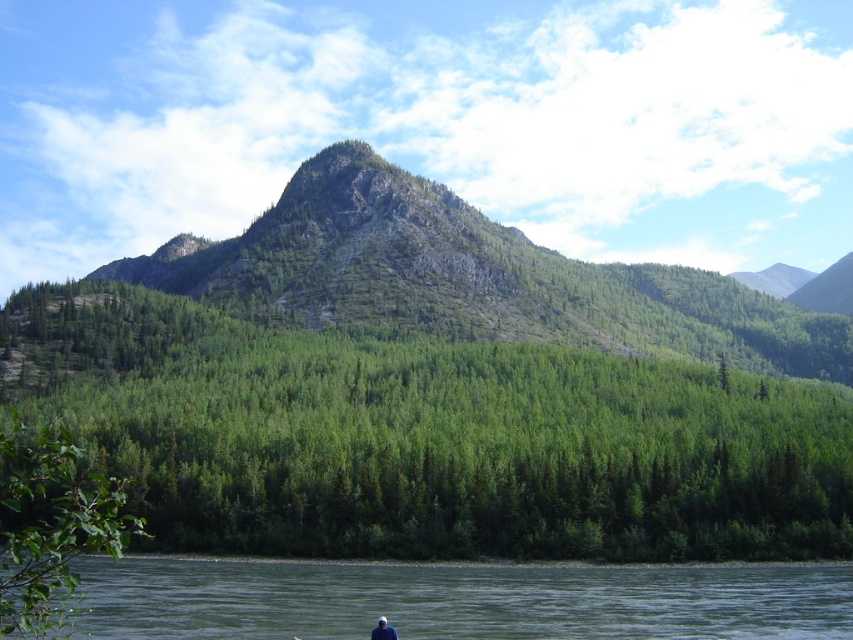
Question: Which point is farther to the camera?

Choices:
 (A) (546, 433)
 (B) (387, 632)

Answer: (A)

Question: Which is nearer to the green leafy branch at lower left?

Choices:
 (A) green leafy forest at center
 (B) green smooth water at lower center
 (C) blue fabric person at lower center

Answer: (B)

Question: Which object appears closest to the camera in this image?

Choices:
 (A) green leafy forest at center
 (B) green smooth water at lower center
 (C) blue fabric person at lower center

Answer: (B)

Question: Does green smooth water at lower center appear under green leafy branch at lower left?

Choices:
 (A) yes
 (B) no

Answer: (A)

Question: Observing the image, what is the correct spatial positioning of green smooth water at lower center in reference to blue fabric person at lower center?

Choices:
 (A) right
 (B) left

Answer: (B)

Question: Observing the image, what is the correct spatial positioning of green leafy branch at lower left in reference to blue fabric person at lower center?

Choices:
 (A) right
 (B) left

Answer: (B)